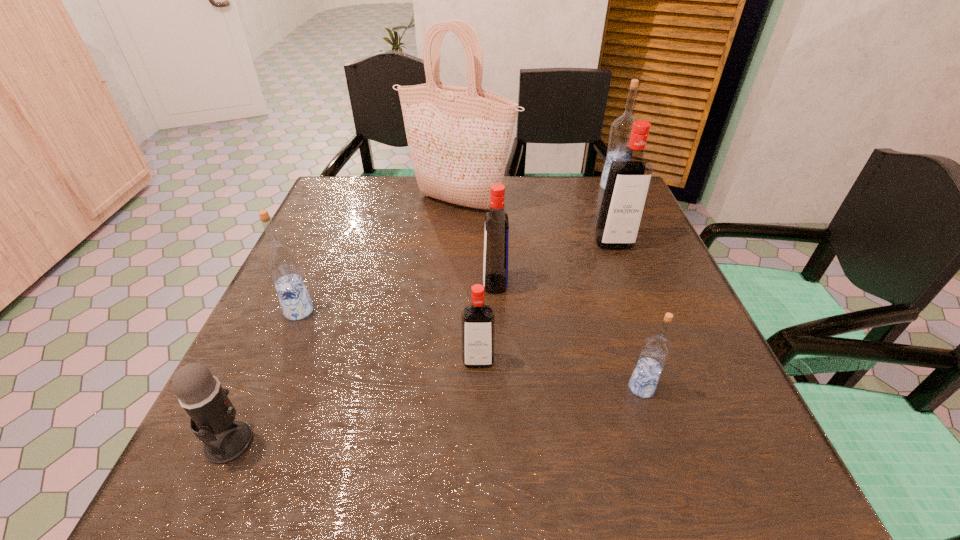
Locate an element on the screen. the smallest red vodka is located at coordinates (477, 320).

Where is `the nearest vodka`? This screenshot has width=960, height=540. the nearest vodka is located at coordinates (655, 351).

Where is `the smallest blue vodka`? Image resolution: width=960 pixels, height=540 pixels. the smallest blue vodka is located at coordinates (655, 351).

The width and height of the screenshot is (960, 540). I want to click on gray microphone, so click(212, 414).

The height and width of the screenshot is (540, 960). In order to click on the nearest object in this screenshot , I will do `click(212, 414)`.

Locate an element on the screen. This screenshot has height=540, width=960. free spot located on the front of the tallest object is located at coordinates (455, 271).

Image resolution: width=960 pixels, height=540 pixels. What are the coordinates of `vacant area situated 0.370m on the left of the farthest blue vodka` in the screenshot? It's located at (472, 187).

Locate an element on the screen. This screenshot has width=960, height=540. free space located on the front and back of the sixth nearest object is located at coordinates (658, 357).

Identify the location of vacant space located on the front and back of the third farthest vodka. The image size is (960, 540). (333, 284).

Locate an element on the screen. The height and width of the screenshot is (540, 960). free region located 0.140m on the front and back of the third farthest vodka is located at coordinates (420, 284).